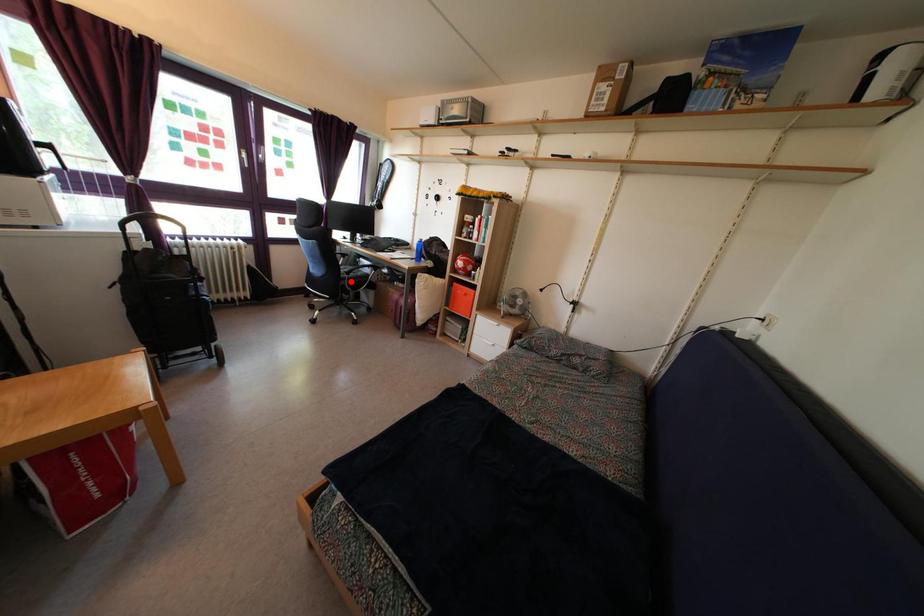
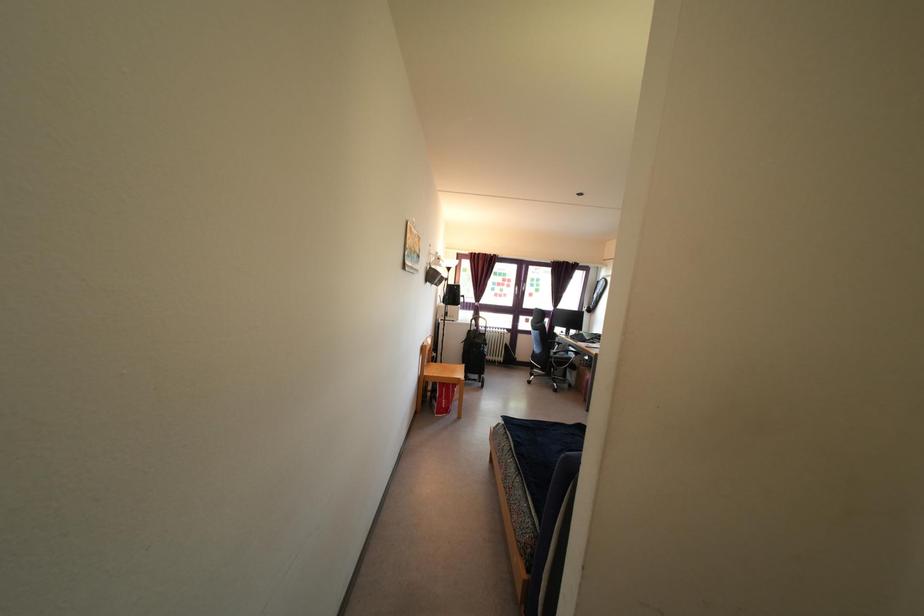
Question: I am providing you with two images of the same scene from different viewpoints. Given a red point in image1, look at the same physical point in image2. Is it:

Choices:
 (A) Closer to the viewpoint
 (B) Farther from the viewpoint

Answer: (B)